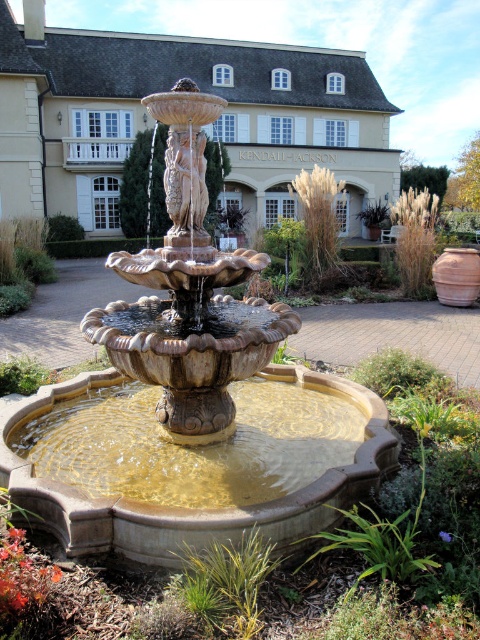
Does matte stone fountain at center lie in front of brown stone fountain at center?

No, it is not.

Describe the element at coordinates (191, 420) in the screenshot. This screenshot has width=480, height=640. I see `matte stone fountain at center` at that location.

Between point (129, 422) and point (93, 596), which one is positioned behind?

Positioned behind is point (129, 422).

Locate an element on the screen. matte stone fountain at center is located at coordinates (191, 420).

Between point (384, 429) and point (175, 220), which one is positioned in front?

Point (384, 429) is in front.

Who is positioned more to the right, matte stone fountain at center or carved stone statue at center?

matte stone fountain at center is more to the right.

Where is `matte stone fountain at center`? Image resolution: width=480 pixels, height=640 pixels. matte stone fountain at center is located at coordinates (191, 420).

The image size is (480, 640). Find the location of `matte stone fountain at center`. matte stone fountain at center is located at coordinates (191, 420).

Can you confirm if brown stone fountain at center is bigger than carved stone statue at center?

Indeed, brown stone fountain at center has a larger size compared to carved stone statue at center.

What do you see at coordinates (398, 531) in the screenshot?
I see `brown stone fountain at center` at bounding box center [398, 531].

Find the location of a particular element. brown stone fountain at center is located at coordinates (398, 531).

At what (x,y) coordinates should I click in order to perform the action: click on brown stone fountain at center. Please return your answer as a coordinate pair (x, y). This screenshot has width=480, height=640. Looking at the image, I should click on (398, 531).